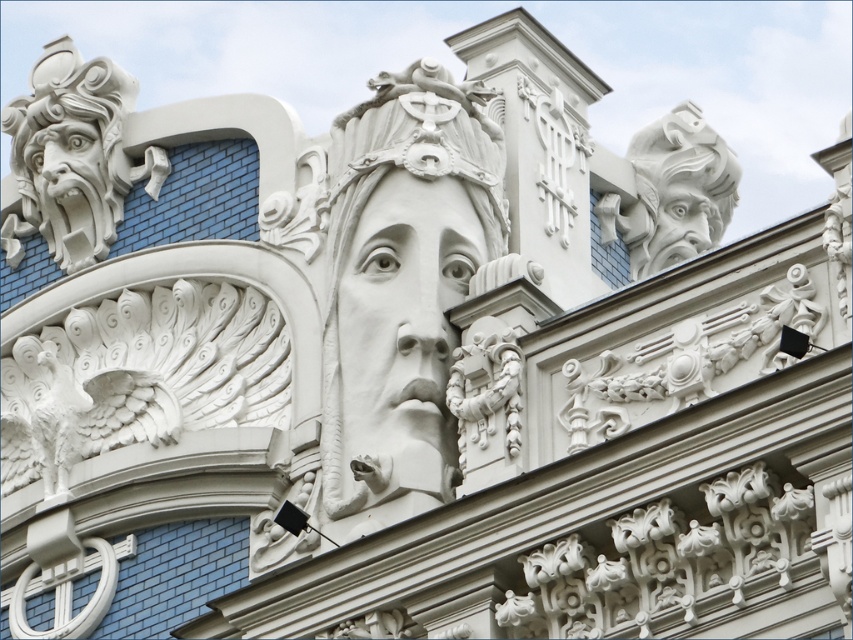
Question: Which object appears closest to the camera in this image?

Choices:
 (A) white stone sculpture at center
 (B) white stone gargoyle at upper right

Answer: (A)

Question: Does white stone face at center appear over white stone gargoyle at upper right?

Choices:
 (A) no
 (B) yes

Answer: (A)

Question: Can you confirm if white stone sculpture at center is bigger than white stone gargoyle at upper right?

Choices:
 (A) yes
 (B) no

Answer: (B)

Question: Estimate the real-world distances between objects in this image. Which object is farther from the white stone face at center?

Choices:
 (A) white stone gargoyle at upper right
 (B) white stone sculpture at center

Answer: (A)

Question: Can you confirm if white stone sculpture at center is smaller than white stone gargoyle at upper right?

Choices:
 (A) yes
 (B) no

Answer: (A)

Question: Which is farther from the white stone sculpture at center?

Choices:
 (A) white stone gargoyle at upper right
 (B) white stone face at center

Answer: (A)